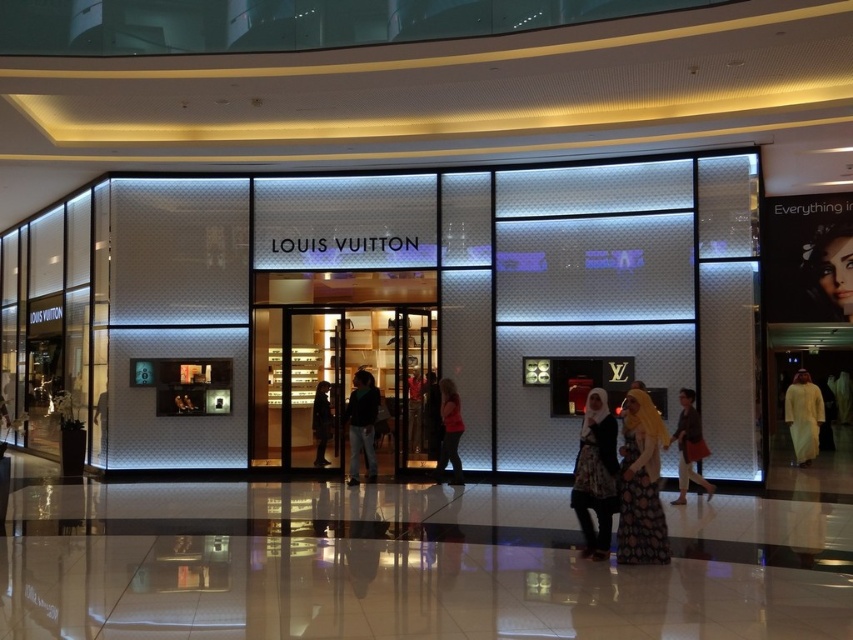
How far apart are printed fabric dress at center and light beige fabric abaya at right?

The distance of printed fabric dress at center from light beige fabric abaya at right is 9.11 meters.

Is point (641, 518) closer to viewer compared to point (813, 413)?

Yes, it is.

Where is `printed fabric dress at center`? The width and height of the screenshot is (853, 640). printed fabric dress at center is located at coordinates (640, 483).

Find the location of `printed fabric dress at center`. printed fabric dress at center is located at coordinates (640, 483).

Describe the element at coordinates (640, 483) in the screenshot. I see `printed fabric dress at center` at that location.

Is printed fabric dress at center below matte black dress at center?

Actually, printed fabric dress at center is above matte black dress at center.

This screenshot has width=853, height=640. I want to click on printed fabric dress at center, so click(640, 483).

Identify the location of printed fabric dress at center. The image size is (853, 640). (640, 483).

Does light beige fabric abaya at right have a lesser height compared to dark fabric coat at center?

Correct, light beige fabric abaya at right is not as tall as dark fabric coat at center.

Who is positioned more to the left, light beige fabric abaya at right or dark fabric coat at center?

Positioned to the left is dark fabric coat at center.

Is point (805, 429) more distant than point (312, 397)?

Yes, point (805, 429) is behind point (312, 397).

This screenshot has height=640, width=853. Identify the location of light beige fabric abaya at right. (804, 417).